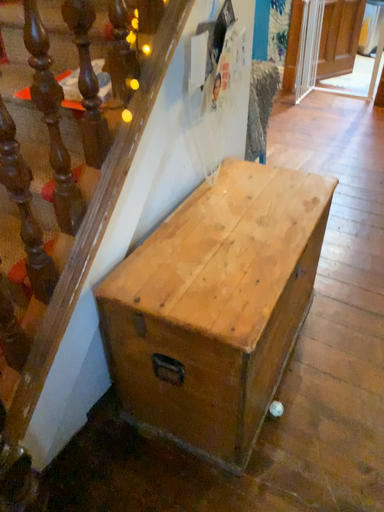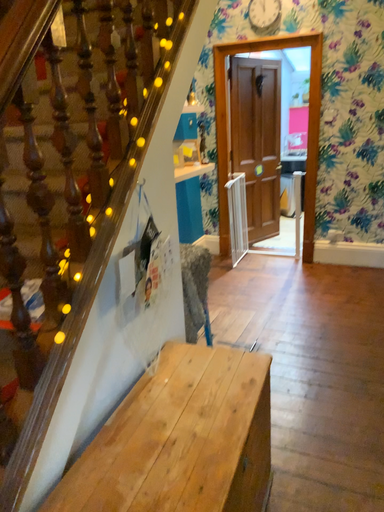
Question: Which way did the camera rotate in the video?

Choices:
 (A) rotated downward
 (B) rotated upward

Answer: (B)